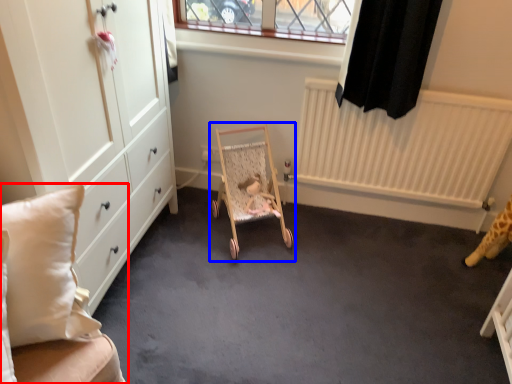
Question: Which object appears closest to the camera in this image, furniture (highlighted by a red box) or baby carriage (highlighted by a blue box)?

Choices:
 (A) furniture
 (B) baby carriage

Answer: (A)